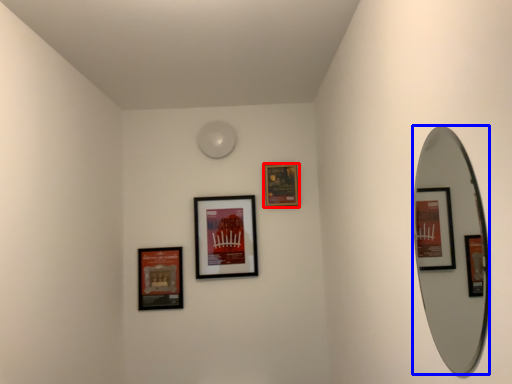
Question: Which point is further to the camera, picture frame (highlighted by a red box) or mirror (highlighted by a blue box)?

Choices:
 (A) picture frame
 (B) mirror

Answer: (A)